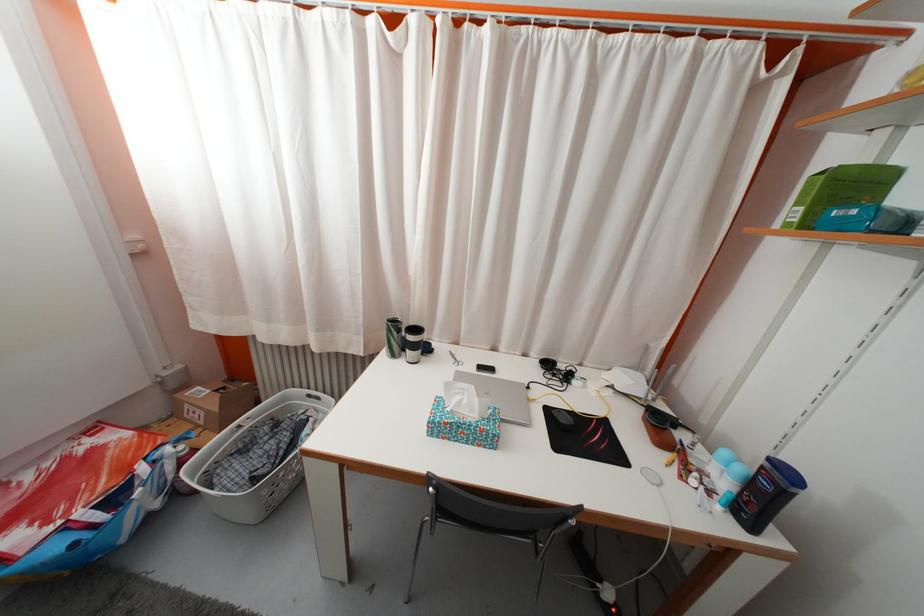
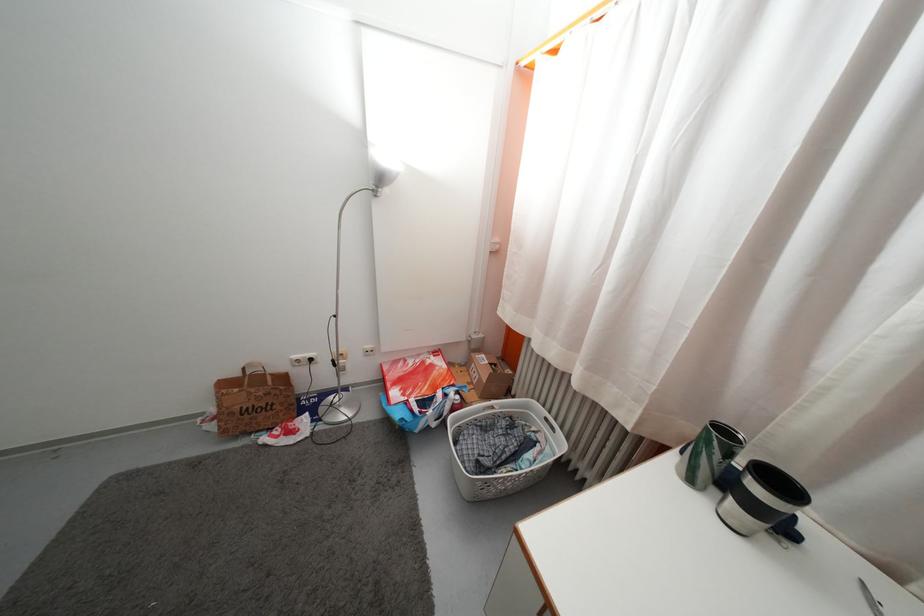
Question: The images are taken continuously from a first-person perspective. In which direction is your viewpoint rotating?

Choices:
 (A) Left
 (B) Right
 (C) Up
 (D) Down

Answer: (A)